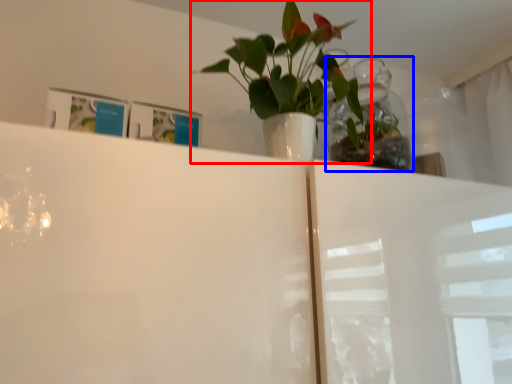
Question: Which object appears closest to the camera in this image, houseplant (highlighted by a red box) or glass vase (highlighted by a blue box)?

Choices:
 (A) houseplant
 (B) glass vase

Answer: (A)